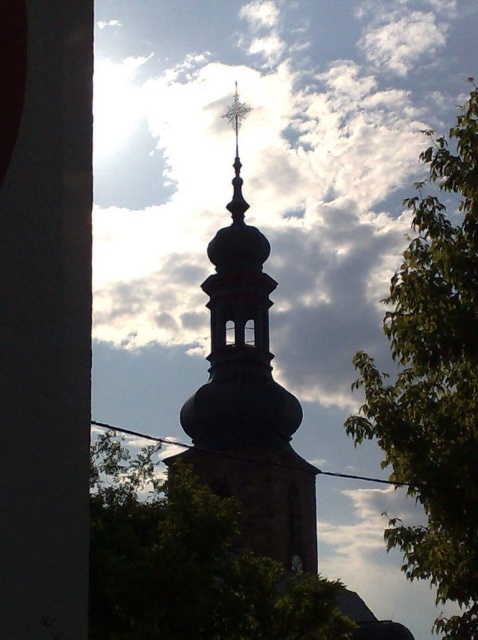
Which is more to the right, green leafy tree at right or green leafy tree at center?

green leafy tree at right

Is point (405, 256) in front of point (111, 428)?

Yes, it is.

Find the location of a particular element. This screenshot has height=640, width=478. green leafy tree at right is located at coordinates (434, 380).

Between point (134, 529) and point (263, 545), which one is positioned in front?

Point (134, 529) is more forward.

Is green leafy tree at center taller than dark brown stone tower at center?

No, green leafy tree at center is not taller than dark brown stone tower at center.

Identify the location of green leafy tree at center. (186, 563).

The width and height of the screenshot is (478, 640). I want to click on green leafy tree at center, so click(186, 563).

Between green leafy tree at right and dark brown stone tower at center, which one has more height?

With more height is green leafy tree at right.

Does point (421, 250) come farther from viewer compared to point (249, 342)?

No, it is not.

Locate an element on the screen. green leafy tree at right is located at coordinates (434, 380).